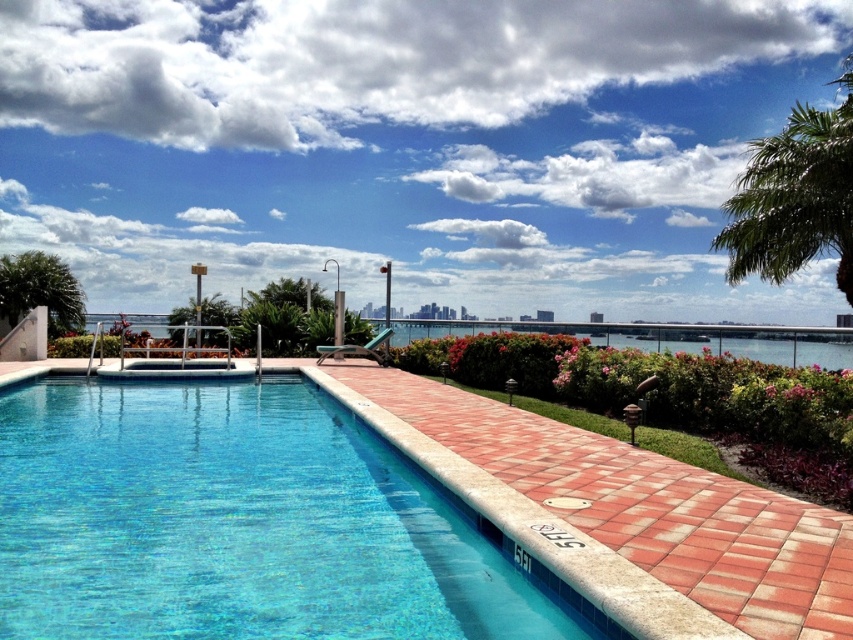
Question: In this image, where is green leafy palm tree at upper right located relative to green leafy palm tree at upper left?

Choices:
 (A) left
 (B) right

Answer: (B)

Question: Does green leafy palm tree at upper right have a greater width compared to green leafy palm tree at upper left?

Choices:
 (A) yes
 (B) no

Answer: (A)

Question: Among these points, which one is farthest from the camera?

Choices:
 (A) (169, 572)
 (B) (848, 189)

Answer: (B)

Question: Which object is closer to the camera taking this photo?

Choices:
 (A) green leafy palm tree at upper left
 (B) green leafy palm tree at upper right

Answer: (B)

Question: From the image, what is the correct spatial relationship of blue tile swimming pool at center in relation to green leafy palm tree at upper left?

Choices:
 (A) below
 (B) above

Answer: (A)

Question: Which point is farther to the camera?

Choices:
 (A) (15, 536)
 (B) (16, 289)

Answer: (B)